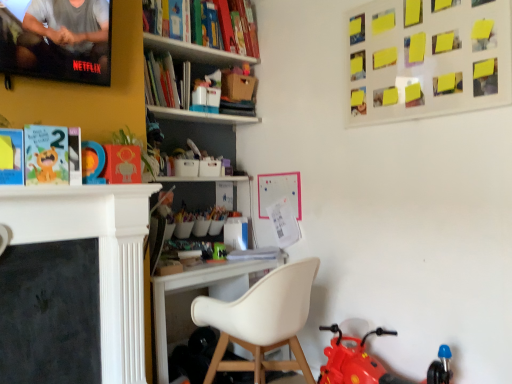
Identify the location of free spot in front of green plastic toy at center, which ranks as the second toy in right-to-left order. (221, 263).